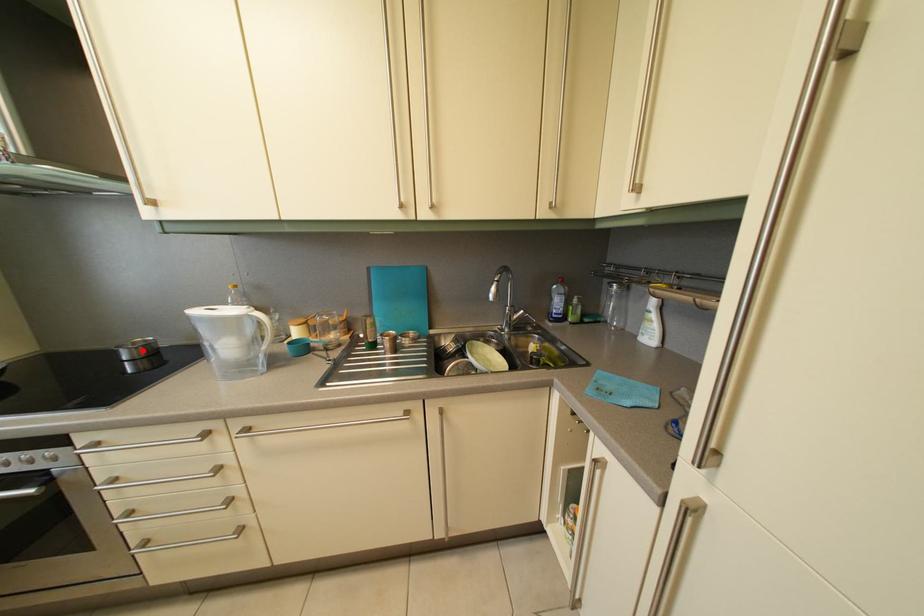
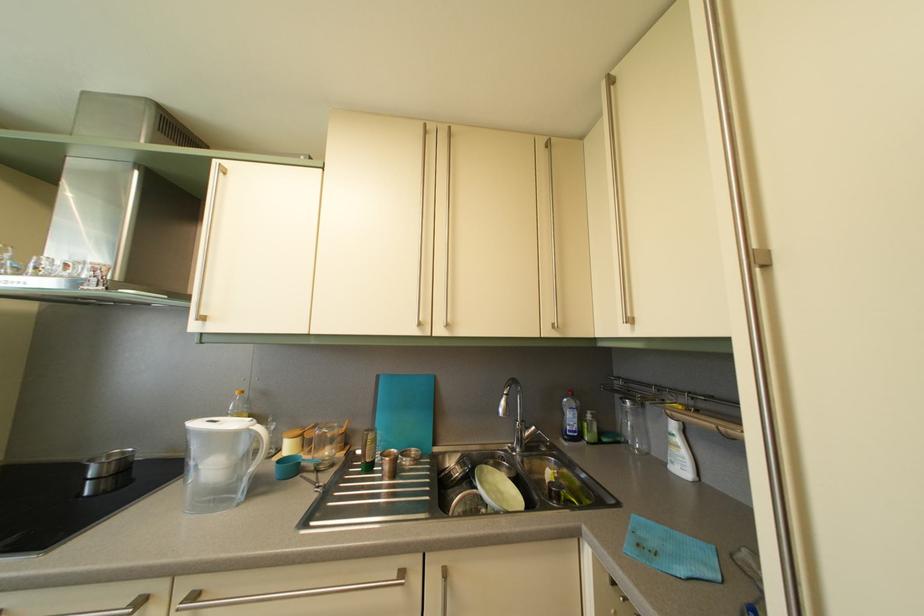
Find the pixel in the second image that matches the highlighted location in the first image.

(118, 463)